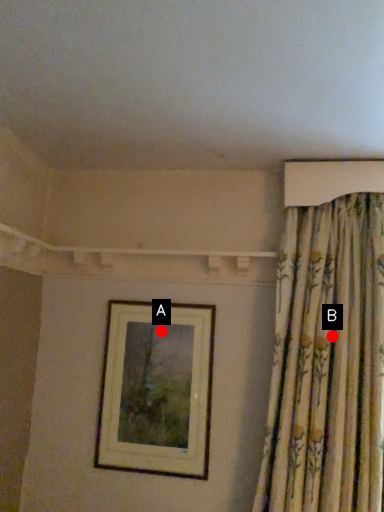
Question: Two points are circled on the image, labeled by A and B beside each circle. Which point is farther from the camera taking this photo?

Choices:
 (A) A is further
 (B) B is further

Answer: (A)